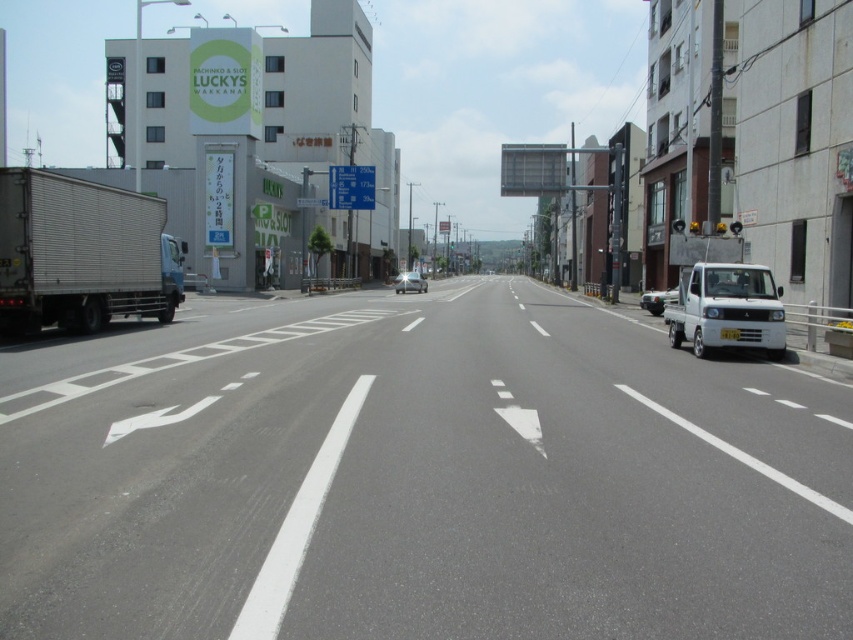
Question: Is silver textured truck at left behind white matte van at right?

Choices:
 (A) yes
 (B) no

Answer: (B)

Question: Which of these objects is positioned farthest from the shiny silver car at center?

Choices:
 (A) white matte truck at left
 (B) white matte truck at right

Answer: (B)

Question: Among these points, which one is farthest from the camera?

Choices:
 (A) (395, 291)
 (B) (662, 298)
 (C) (0, 196)

Answer: (A)

Question: Does white matte truck at left have a smaller size compared to silver textured truck at left?

Choices:
 (A) yes
 (B) no

Answer: (B)

Question: Is white matte truck at right above shiny silver car at center?

Choices:
 (A) no
 (B) yes

Answer: (A)

Question: Estimate the real-world distances between objects in this image. Which object is closer to the white matte truck at left?

Choices:
 (A) white matte van at right
 (B) shiny silver car at center
 (C) silver textured truck at left
 (D) white matte truck at right

Answer: (C)